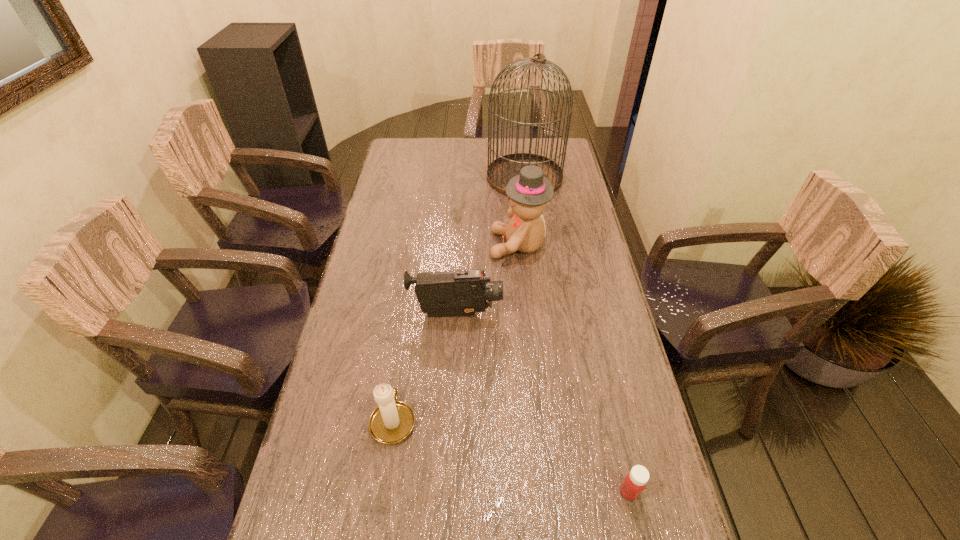
The height and width of the screenshot is (540, 960). Find the location of `the closest object relative to the farthest object`. the closest object relative to the farthest object is located at coordinates (528, 192).

At what (x,y) coordinates should I click in order to perform the action: click on vacant space that satisfies the following two spatial constraints: 1. on the back side of the nearest object; 2. on the front-facing side of the second tallest object. Please return your answer as a coordinate pair (x, y). Looking at the image, I should click on (573, 245).

Where is `vacant space that satisfies the following two spatial constraints: 1. on the front side of the tallest object; 2. on the front-facing side of the fourth shortest object`? vacant space that satisfies the following two spatial constraints: 1. on the front side of the tallest object; 2. on the front-facing side of the fourth shortest object is located at coordinates (534, 245).

This screenshot has height=540, width=960. What are the coordinates of `free space in the image that satisfies the following two spatial constraints: 1. on the front side of the tallest object; 2. on the front-facing side of the camcorder` in the screenshot? It's located at (542, 314).

I want to click on free space that satisfies the following two spatial constraints: 1. on the front-facing side of the rag_doll; 2. on the left side of the medicine, so click(x=541, y=491).